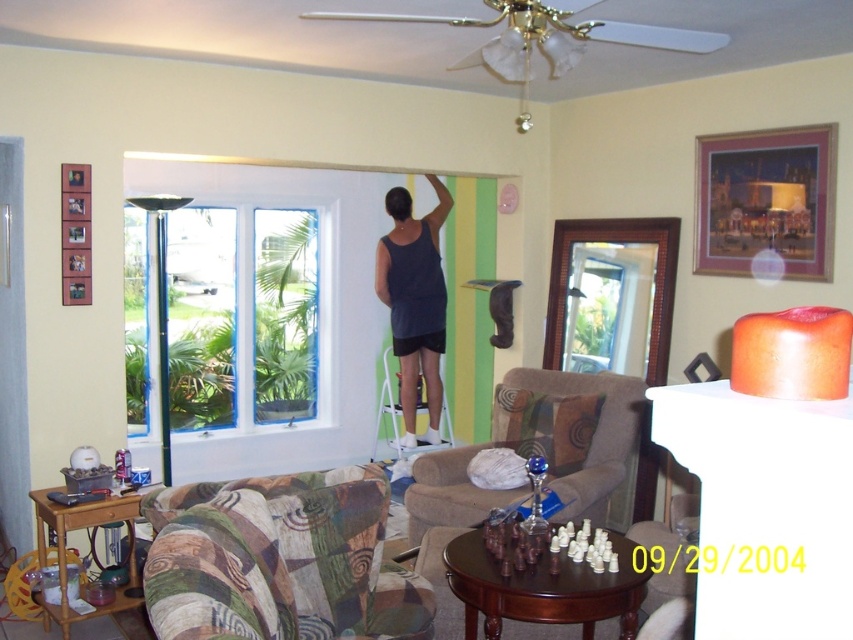
Question: Where is white painted window at left located in relation to white plastic ladder at center in the image?

Choices:
 (A) above
 (B) below

Answer: (A)

Question: Estimate the real-world distances between objects in this image. Which object is farther from the white plastic ladder at center?

Choices:
 (A) multicolored fabric couch at center
 (B) patchwork fabric couch at lower left
 (C) dark blue tank top at center

Answer: (B)

Question: Which point is farther to the camera?

Choices:
 (A) multicolored fabric couch at center
 (B) dark blue tank top at center
 (C) patchwork fabric couch at lower left

Answer: (B)

Question: Considering the real-world distances, which object is farthest from the patchwork fabric couch at lower left?

Choices:
 (A) white painted window at left
 (B) multicolored fabric couch at center

Answer: (A)

Question: Is patchwork fabric couch at lower left closer to the viewer compared to white painted window at left?

Choices:
 (A) no
 (B) yes

Answer: (B)

Question: Is white painted window at left positioned in front of multicolored fabric couch at center?

Choices:
 (A) no
 (B) yes

Answer: (A)